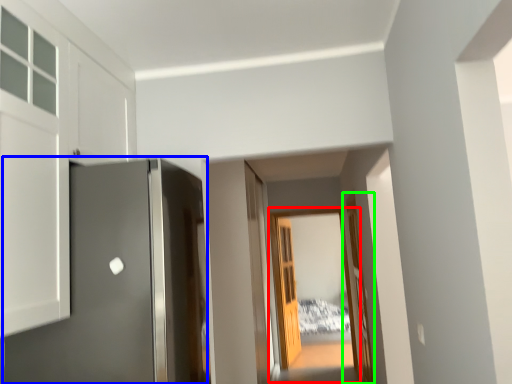
Question: Considering the real-world distances, which object is farthest from glass door (highlighted by a red box)? door (highlighted by a blue box) or door (highlighted by a green box)?

Choices:
 (A) door
 (B) door

Answer: (A)